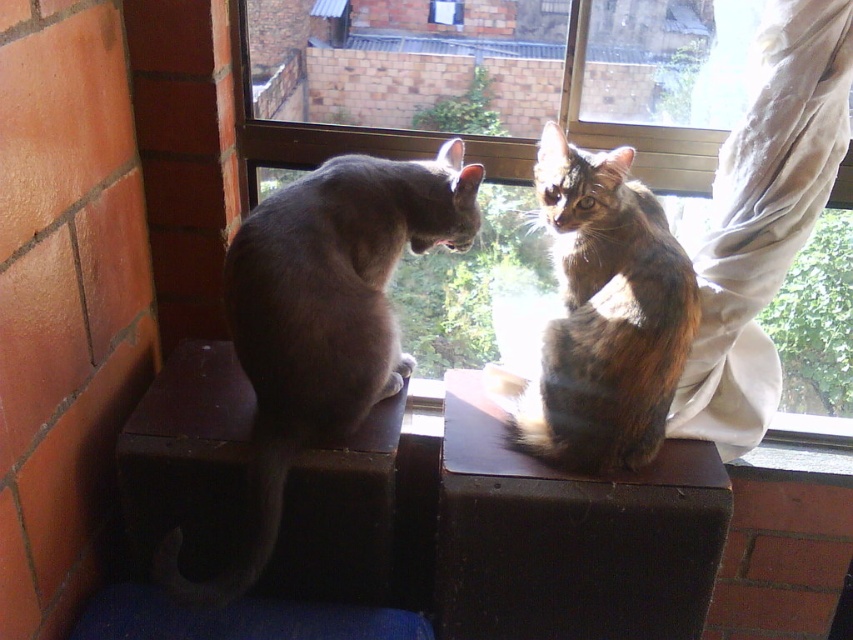
Question: Which object appears farthest from the camera in this image?

Choices:
 (A) transparent glass window at center
 (B) gray fur cat at left

Answer: (B)

Question: Which is nearer to the tabby fur cat at center?

Choices:
 (A) transparent glass window at center
 (B) gray fur cat at left

Answer: (A)

Question: Which of the following is the farthest from the observer?

Choices:
 (A) tabby fur cat at center
 (B) gray fur cat at left

Answer: (A)

Question: Is gray fur cat at left to the right of tabby fur cat at center from the viewer's perspective?

Choices:
 (A) no
 (B) yes

Answer: (A)

Question: Does transparent glass window at center come behind tabby fur cat at center?

Choices:
 (A) no
 (B) yes

Answer: (A)

Question: Is transparent glass window at center below tabby fur cat at center?

Choices:
 (A) yes
 (B) no

Answer: (B)